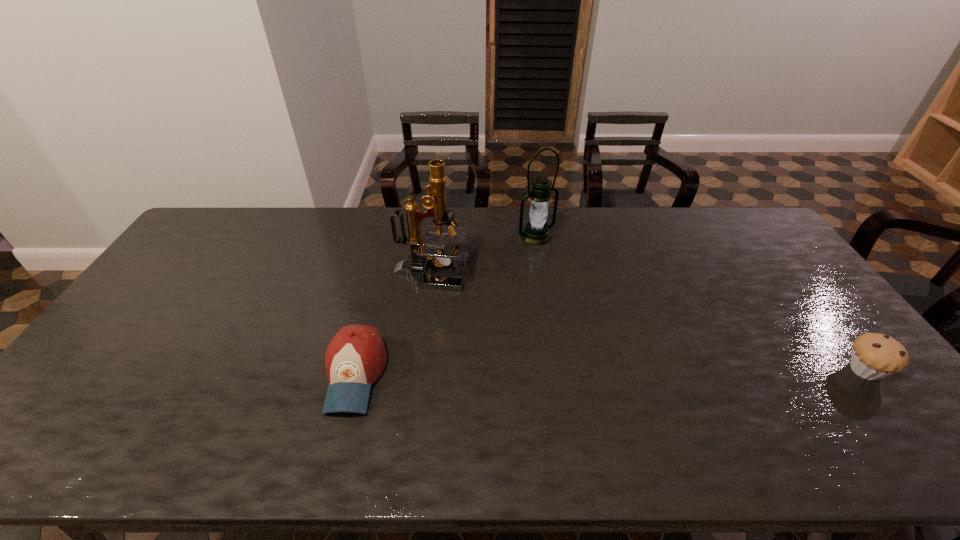
At what (x,y) coordinates should I click in order to perform the action: click on vacant space at the right edge. Please return your answer as a coordinate pair (x, y). This screenshot has width=960, height=540. Looking at the image, I should click on (842, 362).

In the image, there is a desktop. Identify the location of free space at the near left corner. (74, 393).

The height and width of the screenshot is (540, 960). In order to click on free location at the far right corner of the desktop in this screenshot , I will do `click(748, 211)`.

Where is `vacant area between the baseball cap and the third nearest object`? vacant area between the baseball cap and the third nearest object is located at coordinates (393, 324).

You are a GUI agent. You are given a task and a screenshot of the screen. Output one action in this format:
    pyautogui.click(x=<x>, y=<y>)
    Task: Click on the free space between the third nearest object and the baseball cap
    
    Given the screenshot: What is the action you would take?
    pyautogui.click(x=393, y=324)

Identify the location of unoccupied area between the muffin and the third nearest object. (648, 322).

At what (x,y) coordinates should I click in order to perform the action: click on blank region between the lantern and the baseball cap. Please return your answer as a coordinate pair (x, y). The image size is (960, 540). Looking at the image, I should click on (445, 305).

Where is `free area in between the muffin and the baseball cap`? The height and width of the screenshot is (540, 960). free area in between the muffin and the baseball cap is located at coordinates (610, 373).

Locate an element on the screen. The image size is (960, 540). free space between the muffin and the farthest object is located at coordinates point(701,303).

Locate an element on the screen. free spot between the baseball cap and the lantern is located at coordinates (445, 305).